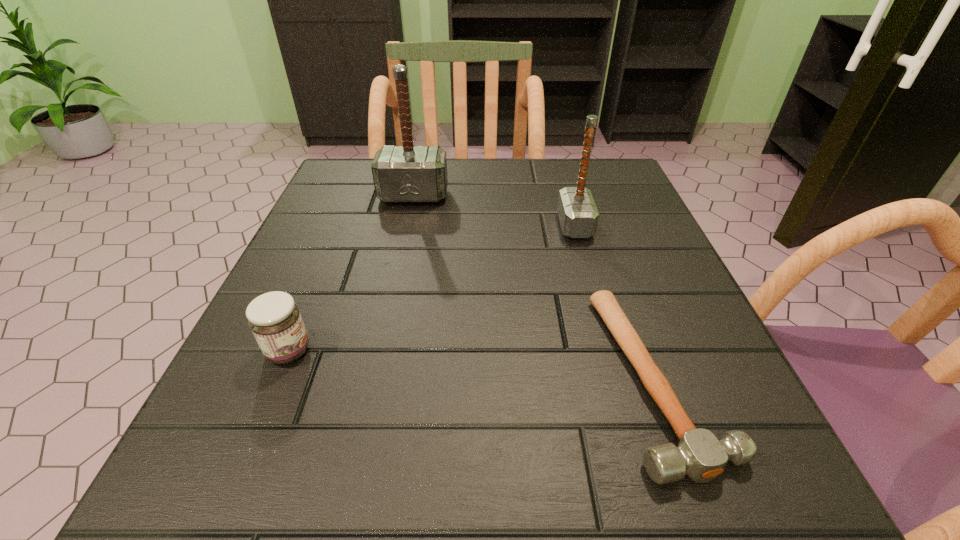
Where is `vacant space at the far edge`? Image resolution: width=960 pixels, height=540 pixels. vacant space at the far edge is located at coordinates (449, 206).

Find the location of a particular element. free spot at the near edge of the desktop is located at coordinates (575, 458).

Image resolution: width=960 pixels, height=540 pixels. In order to click on free space at the left edge of the desktop in this screenshot , I will do `click(200, 420)`.

What are the coordinates of `vacant space at the right edge` in the screenshot? It's located at (672, 313).

Identify the location of free space at the far left corner. (366, 166).

The image size is (960, 540). In the image, there is a desktop. Find the location of `vacant space at the far right corner`. vacant space at the far right corner is located at coordinates (618, 202).

Image resolution: width=960 pixels, height=540 pixels. Find the location of `vacant region at the near right corner`. vacant region at the near right corner is located at coordinates (787, 507).

Where is `vacant area that lies between the third object from right to left and the shortest hammer`? This screenshot has height=540, width=960. vacant area that lies between the third object from right to left and the shortest hammer is located at coordinates (536, 287).

Where is `free space between the farthest object and the second tallest object`? This screenshot has height=540, width=960. free space between the farthest object and the second tallest object is located at coordinates (494, 211).

I want to click on free spot between the leftmost hammer and the shortest hammer, so click(x=536, y=287).